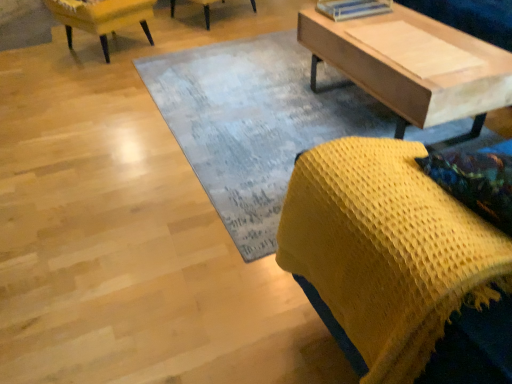
Find the location of a particular element. vacant space to the left of yellow fabric chair at upper left, arranged as the first chair when viewed from the back is located at coordinates (36, 55).